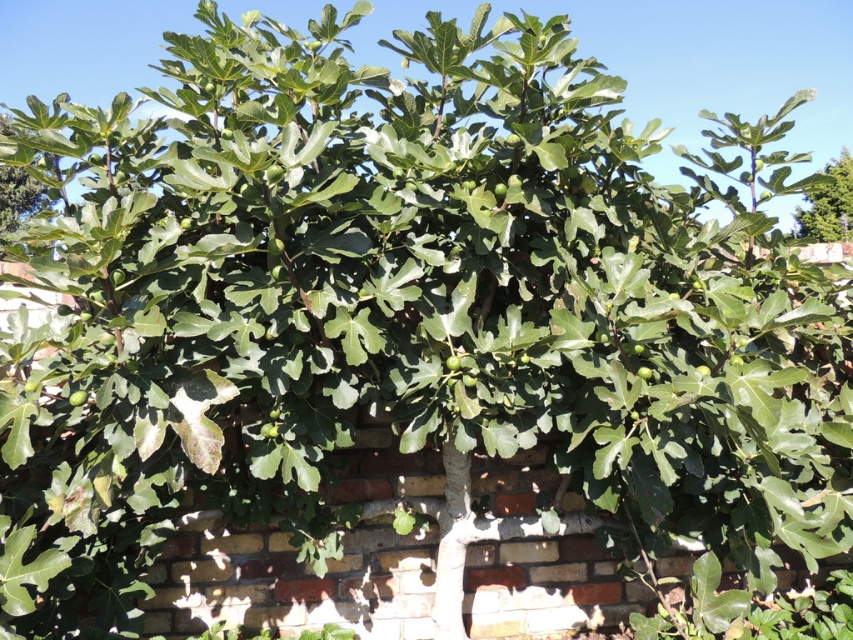
Question: Which object is closer to the camera taking this photo?

Choices:
 (A) green matte fig tree at upper left
 (B) green leafy fig tree at upper right

Answer: (A)

Question: Can you confirm if green leafy fig tree at upper right is positioned to the left of green matte fig tree at upper left?

Choices:
 (A) yes
 (B) no

Answer: (B)

Question: Can you confirm if green leafy fig tree at upper right is smaller than green matte fig tree at upper left?

Choices:
 (A) no
 (B) yes

Answer: (B)

Question: Which point appears closest to the camera in this image?

Choices:
 (A) pyautogui.click(x=845, y=184)
 (B) pyautogui.click(x=9, y=179)

Answer: (B)

Question: Which object is farther from the camera taking this photo?

Choices:
 (A) green matte fig tree at upper left
 (B) green leafy fig tree at upper right

Answer: (B)

Question: Is green leafy fig tree at upper right positioned before green matte fig tree at upper left?

Choices:
 (A) yes
 (B) no

Answer: (B)